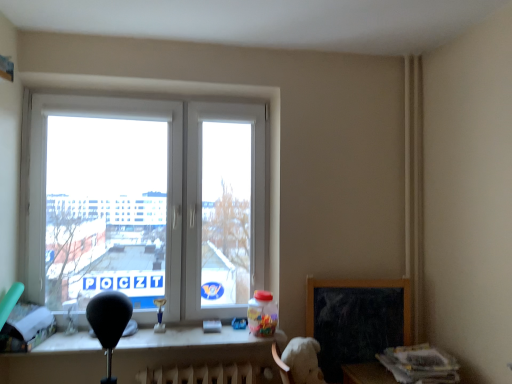
Question: Looking at their shapes, would you say black matte chalkboard at lower right is wider or thinner than white plastic window at center?

Choices:
 (A) thin
 (B) wide

Answer: (A)

Question: Considering the positions of black matte chalkboard at lower right and white plastic window at center in the image, is black matte chalkboard at lower right taller or shorter than white plastic window at center?

Choices:
 (A) short
 (B) tall

Answer: (A)

Question: Estimate the real-world distances between objects in this image. Which object is closer to the white plastic table at lower center?

Choices:
 (A) black matte chalkboard at lower right
 (B) white plastic window at center

Answer: (A)

Question: Based on their relative distances, which object is farther from the black matte chalkboard at lower right?

Choices:
 (A) white plastic table at lower center
 (B) white plastic window at center

Answer: (B)